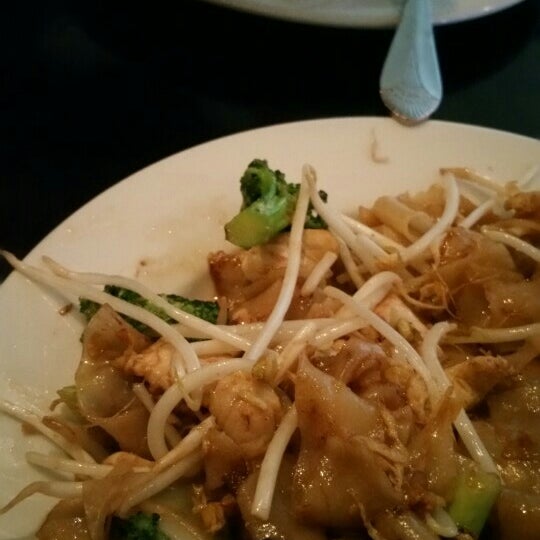
At what (x,y) coordinates should I click in order to perform the action: click on silverware. Please return your answer as a coordinate pair (x, y). Looking at the image, I should click on (416, 9).